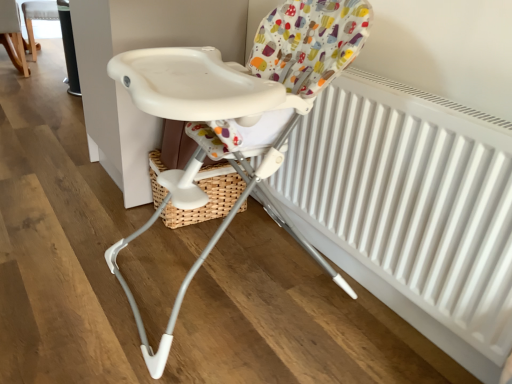
Question: Does white plastic chair at upper left, the second chair in the top-to-bottom sequence, have a smaller size compared to white plastic highchair at upper center, which ranks as the third chair in front-to-back order?

Choices:
 (A) yes
 (B) no

Answer: (B)

Question: Is the surface of white plastic chair at upper left, the first chair viewed from the left, in direct contact with white plastic highchair at upper center, placed as the second chair when sorted from left to right?

Choices:
 (A) yes
 (B) no

Answer: (B)

Question: Is white plastic highchair at upper center, which ranks as the third chair in front-to-back order, at the back of white plastic chair at upper left, placed as the second chair when sorted from front to back?

Choices:
 (A) no
 (B) yes

Answer: (A)

Question: Is white plastic chair at upper left, positioned as the 2th chair in back-to-front order, positioned before white plastic highchair at upper center, which is the third chair from bottom to top?

Choices:
 (A) yes
 (B) no

Answer: (A)

Question: Does white plastic chair at upper left, the second chair in the top-to-bottom sequence, lie behind white plastic highchair at upper center, placed as the 2th chair when sorted from right to left?

Choices:
 (A) yes
 (B) no

Answer: (B)

Question: Is white plastic highchair at center, marked as the 3th chair in a left-to-right arrangement, inside or outside of white plastic chair at upper left, the second chair in the top-to-bottom sequence?

Choices:
 (A) outside
 (B) inside

Answer: (A)

Question: Based on their positions, is white plastic highchair at center, marked as the third chair in a top-to-bottom arrangement, located to the left or right of white plastic chair at upper left, the 2th chair ordered from the bottom?

Choices:
 (A) right
 (B) left

Answer: (A)

Question: Does point (144, 332) appear closer or farther from the camera than point (11, 49)?

Choices:
 (A) farther
 (B) closer

Answer: (B)

Question: In terms of size, does white plastic highchair at center, marked as the 3th chair in a left-to-right arrangement, appear bigger or smaller than white plastic chair at upper left, the first chair viewed from the left?

Choices:
 (A) small
 (B) big

Answer: (B)

Question: From a real-world perspective, relative to white plastic highchair at center, arranged as the third chair when viewed from the back, is white plastic highchair at upper center, placed as the 2th chair when sorted from right to left, vertically above or below?

Choices:
 (A) below
 (B) above

Answer: (A)

Question: Is white plastic highchair at upper center, placed as the 2th chair when sorted from right to left, situated inside white plastic highchair at center, marked as the 3th chair in a left-to-right arrangement, or outside?

Choices:
 (A) outside
 (B) inside

Answer: (A)

Question: Considering the positions of white plastic highchair at upper center, which ranks as the third chair in front-to-back order, and white plastic highchair at center, which ranks as the 1th chair in front-to-back order, in the image, is white plastic highchair at upper center, which ranks as the third chair in front-to-back order, taller or shorter than white plastic highchair at center, which ranks as the 1th chair in front-to-back order,?

Choices:
 (A) short
 (B) tall

Answer: (A)

Question: Is white plastic highchair at upper center, the first chair from the back, to the left or to the right of white plastic highchair at center, which ranks as the 1th chair in front-to-back order, in the image?

Choices:
 (A) right
 (B) left

Answer: (B)

Question: From a real-world perspective, is white plastic chair at upper left, the 2th chair ordered from the bottom, above or below white matte radiator at center?

Choices:
 (A) above
 (B) below

Answer: (B)

Question: Would you say white plastic chair at upper left, placed as the second chair when sorted from front to back, is to the left or to the right of white matte radiator at center in the picture?

Choices:
 (A) right
 (B) left

Answer: (B)